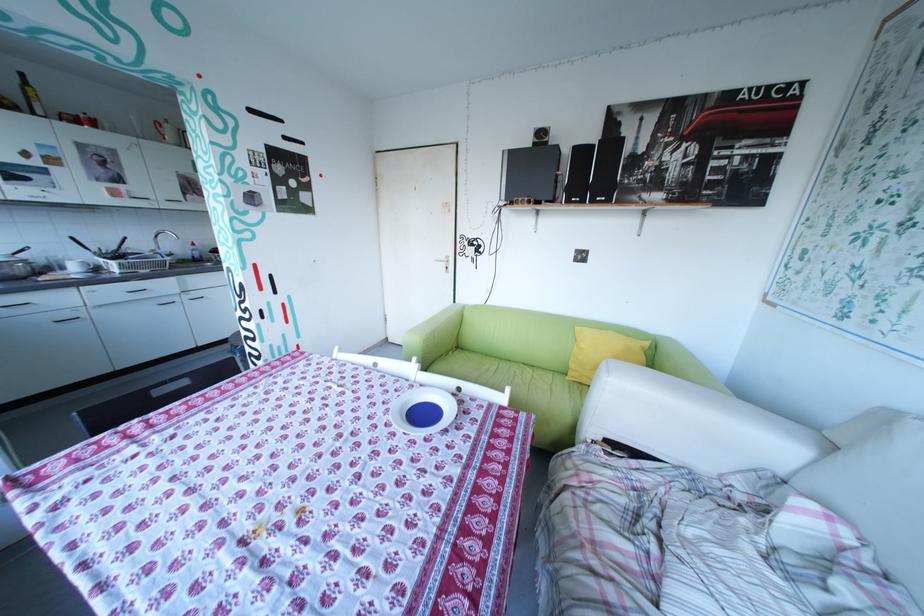
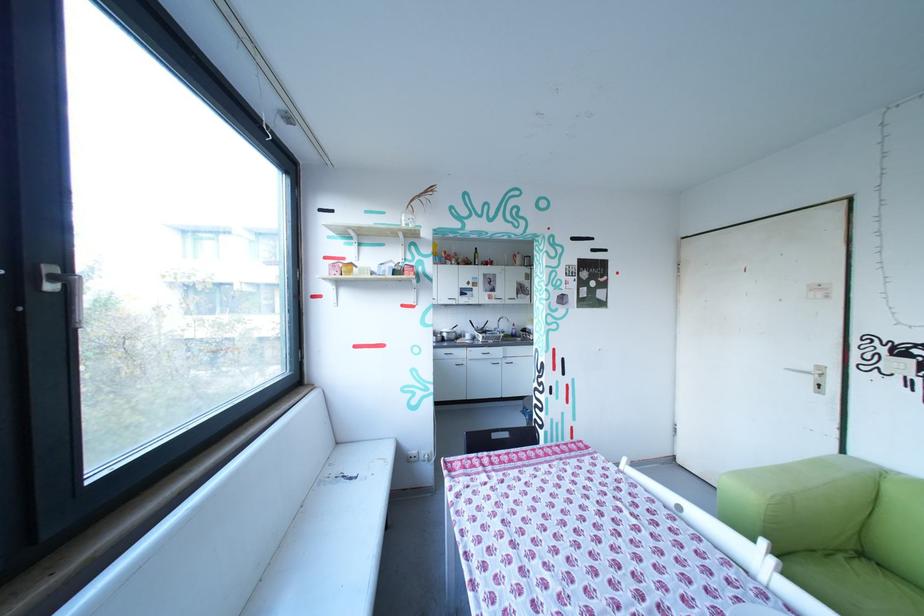
In the second image, find the point that corresponds to (456,265) in the first image.

(821, 379)